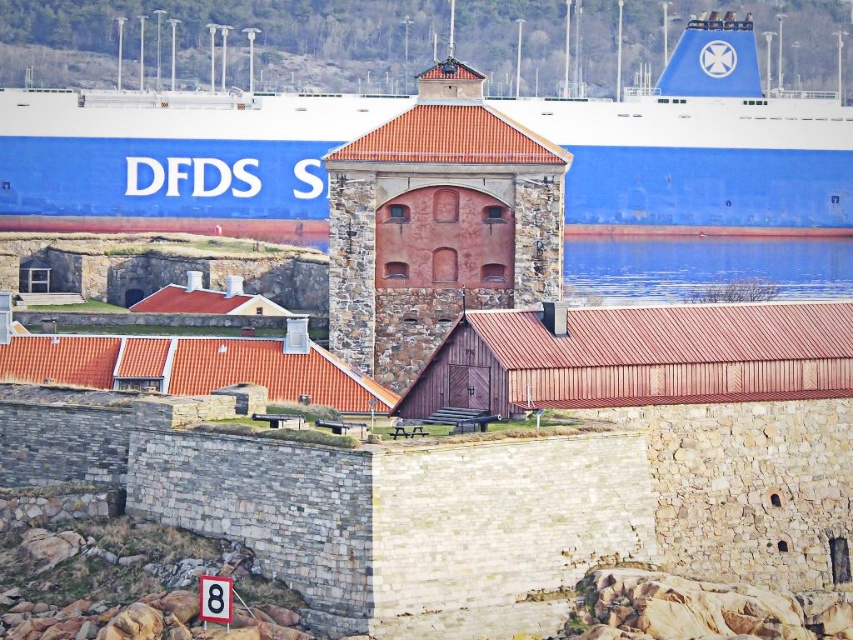
You are a tourist standing on the dock looking at the blue matte ship at upper center and the blue water at center. Which object is located to the left of the other?

The blue matte ship at upper center is positioned on the left side of blue water at center.

You are a photographer standing on the dock and want to capture both the blue matte ship at upper center and the blue water at center in your photo. Which object will appear taller in the final image?

The blue matte ship at upper center will appear taller in the photo because it has a greater height compared to the blue water at center.

You are standing on the dock and want to board the blue matte ship at upper center. Is the blue water at center between you and the ship?

The blue matte ship at upper center is closer to the viewer than the blue water at center, so the blue water at center is not between you and the ship.